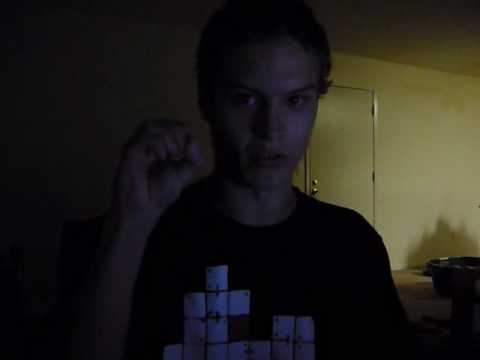
The width and height of the screenshot is (480, 360). What are the coordinates of `door` in the screenshot? It's located at (354, 181).